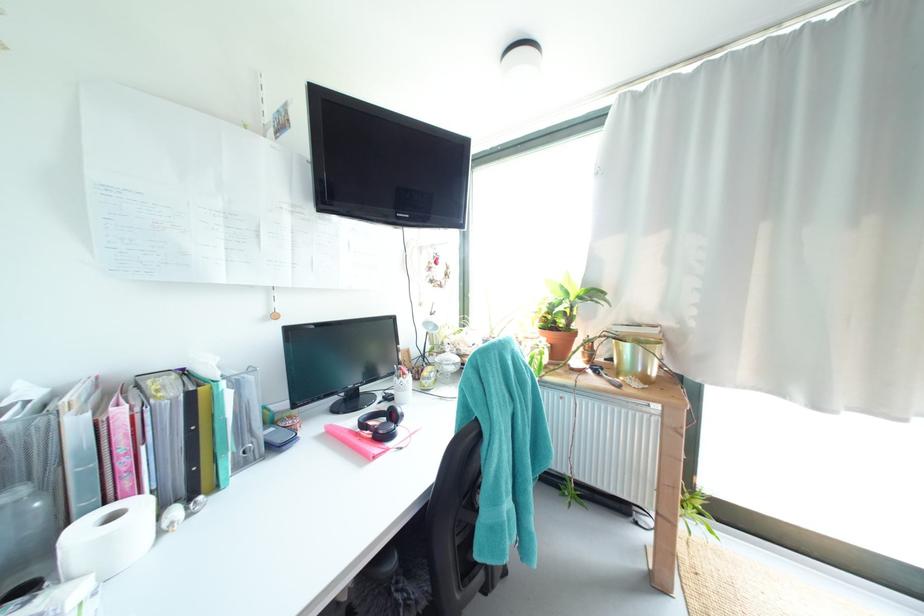
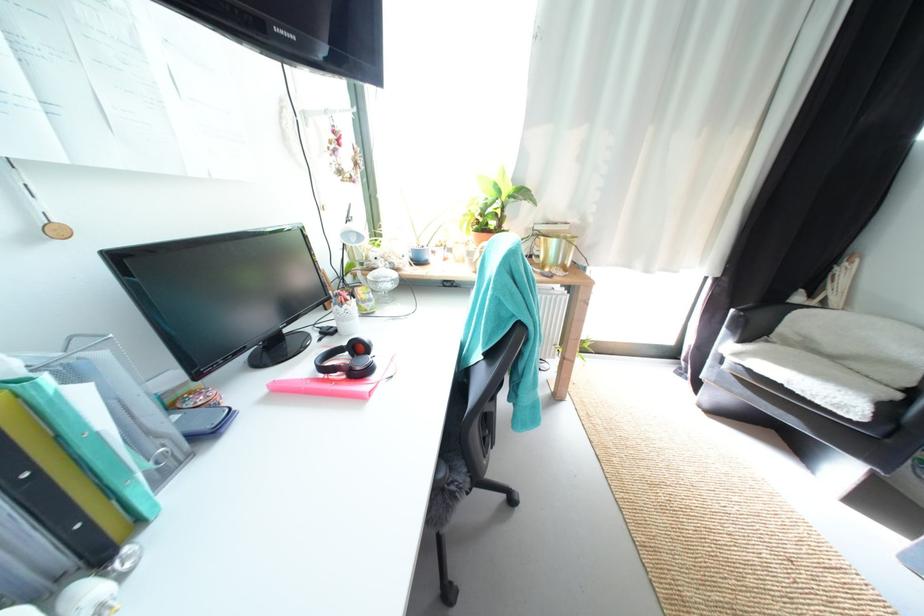
Where in the second image is the point corresponding to point (635, 349) from the first image?

(562, 244)